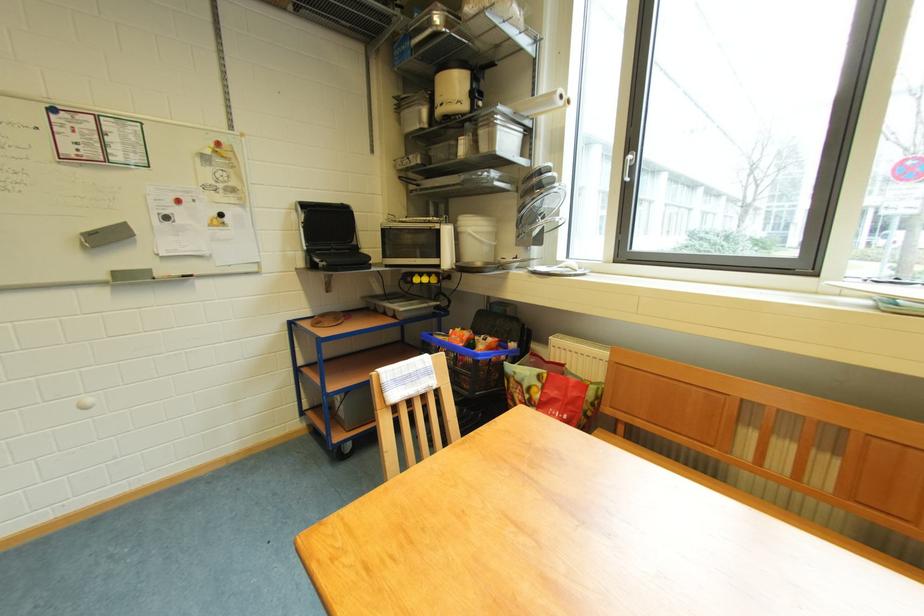
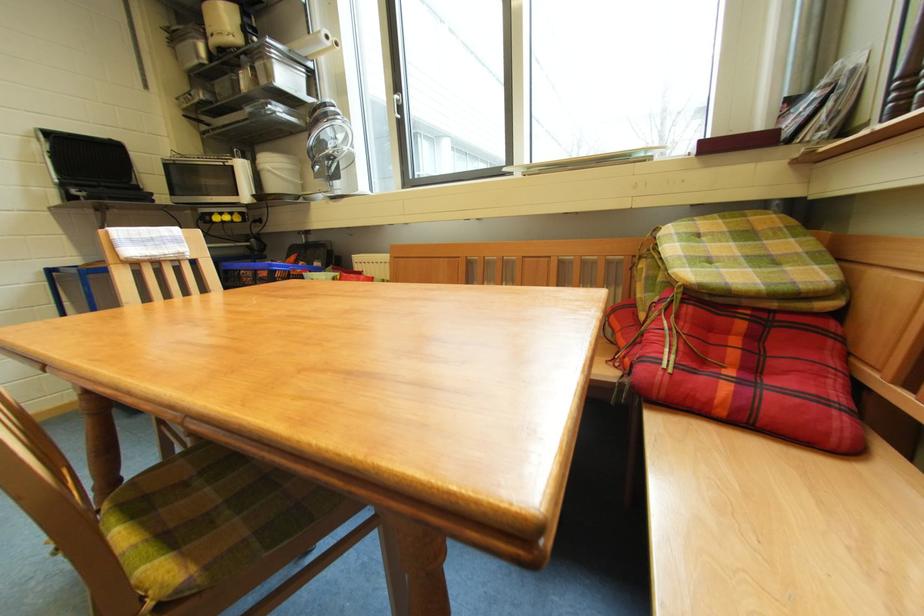
Find the pixel in the second image that matches point 330,264 in the first image.

(88, 193)